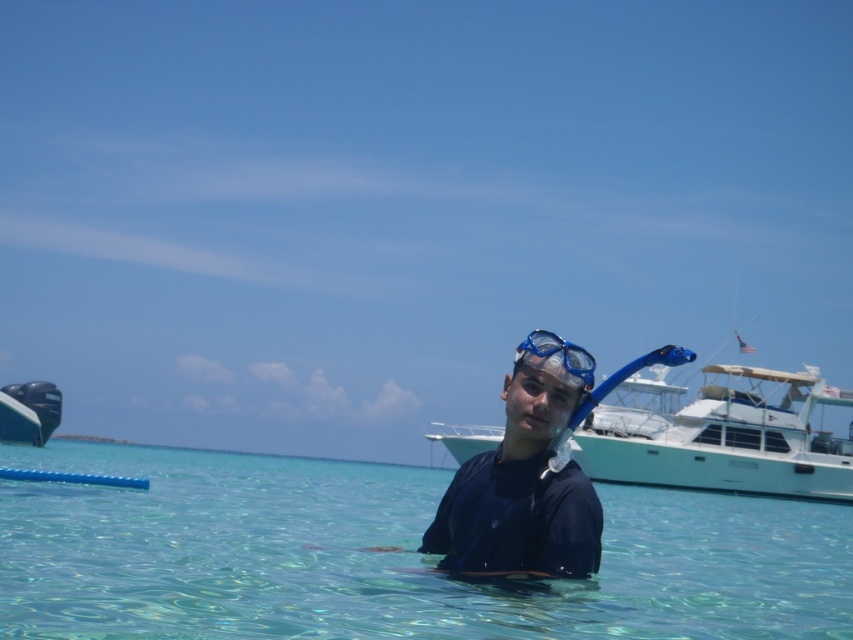
Who is more distant from viewer, (576, 460) or (50, 432)?

Point (50, 432)

Does white glossy boat at center have a greater width compared to blue glossy boat at left?

Yes.

This screenshot has width=853, height=640. Identify the location of white glossy boat at center. point(711,433).

Does clear water at center have a lesser width compared to white glossy boat at center?

Incorrect, clear water at center's width is not less than white glossy boat at center's.

Is point (419, 529) more distant than point (462, 458)?

That is False.

Is point (54, 582) closer to camera compared to point (729, 472)?

That is True.

Where is `clear water at center`? clear water at center is located at coordinates (386, 556).

Consider the image. Can you confirm if blue glossy boat at left is positioned above blue matte snorkel mask at center?

No.

Who is positioned more to the left, blue glossy boat at left or blue matte snorkel mask at center?

blue glossy boat at left is more to the left.

This screenshot has width=853, height=640. Find the location of `blue glossy boat at left`. blue glossy boat at left is located at coordinates (28, 412).

This screenshot has height=640, width=853. Identify the location of blue glossy boat at left. (28, 412).